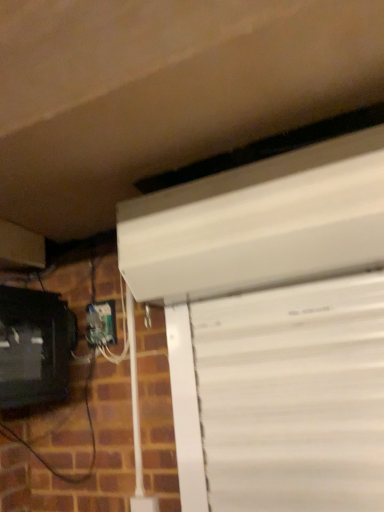
Question: From a real-world perspective, is matte black monitor at lower left positioned above or below white plastic electric outlet at lower left?

Choices:
 (A) above
 (B) below

Answer: (B)

Question: Does point coord(31,391) appear closer or farther from the camera than point coord(97,343)?

Choices:
 (A) farther
 (B) closer

Answer: (B)

Question: From their relative heights in the image, would you say matte black monitor at lower left is taller or shorter than white plastic electric outlet at lower left?

Choices:
 (A) tall
 (B) short

Answer: (A)

Question: Considering the positions of white plastic electric outlet at lower left and matte black monitor at lower left in the image, is white plastic electric outlet at lower left wider or thinner than matte black monitor at lower left?

Choices:
 (A) thin
 (B) wide

Answer: (A)

Question: Is white plastic electric outlet at lower left taller or shorter than matte black monitor at lower left?

Choices:
 (A) short
 (B) tall

Answer: (A)

Question: Considering the positions of point (92, 307) and point (31, 314), is point (92, 307) closer or farther from the camera than point (31, 314)?

Choices:
 (A) closer
 (B) farther

Answer: (A)

Question: From the image's perspective, is white plastic electric outlet at lower left located above or below matte black monitor at lower left?

Choices:
 (A) above
 (B) below

Answer: (A)